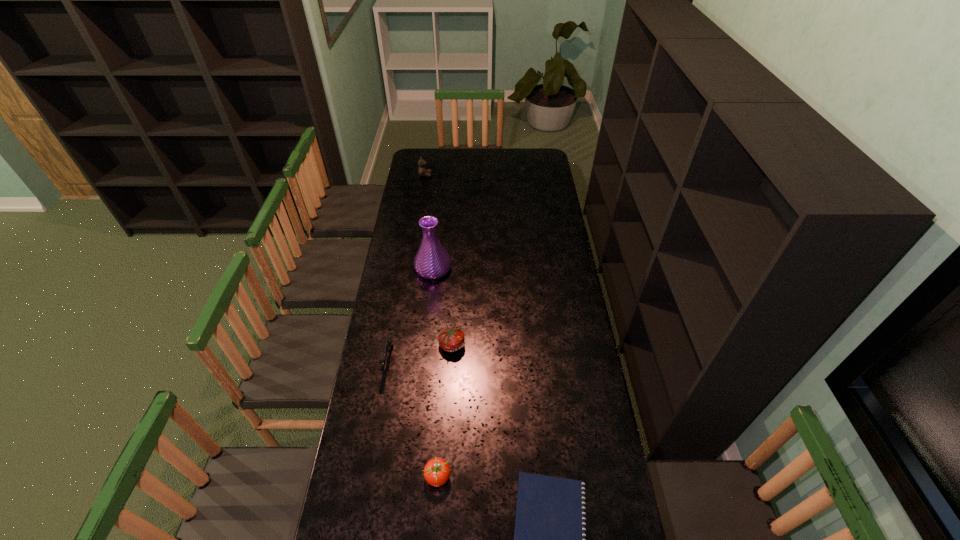
Locate an element on the screen. free spot that satisfies the following two spatial constraints: 1. on the face of the nearer tomato; 2. on the right side of the teddy bear is located at coordinates (379, 477).

Identify the location of vacant point that satisfies the following two spatial constraints: 1. on the back side of the fifth nearest object; 2. on the face of the teddy bear. (444, 175).